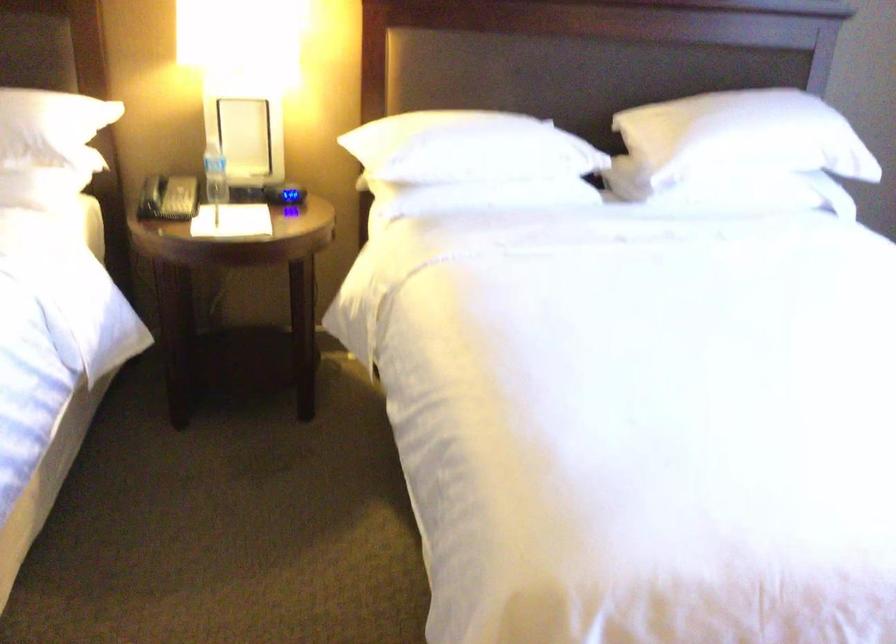
Where would you lift the plastic water bottle? Please return your answer as a coordinate pair (x, y).

(214, 175)